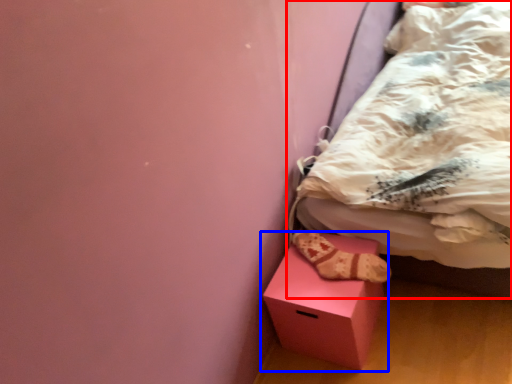
Question: Which point is closer to the camera, bed (highlighted by a red box) or box (highlighted by a blue box)?

Choices:
 (A) bed
 (B) box

Answer: (A)